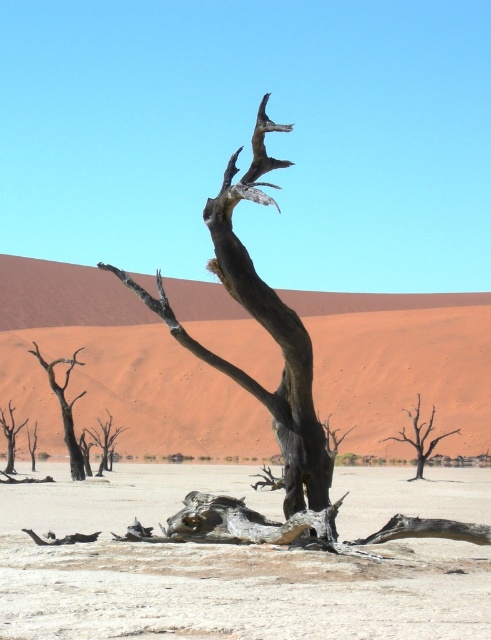
You are an environmental scientist observing the desert landscape. You notice the dark gray bark tree at center and the brown textured tree at center. Which tree is positioned higher in the image?

The dark gray bark tree at center is positioned higher than the brown textured tree at center.

You are a hiker trying to navigate between the dark gray bark tree at center and the dark brown wood tree at left. Which tree is closer to you?

The dark gray bark tree at center is positioned over the dark brown wood tree at left, so the dark brown wood tree at left is closer to you.